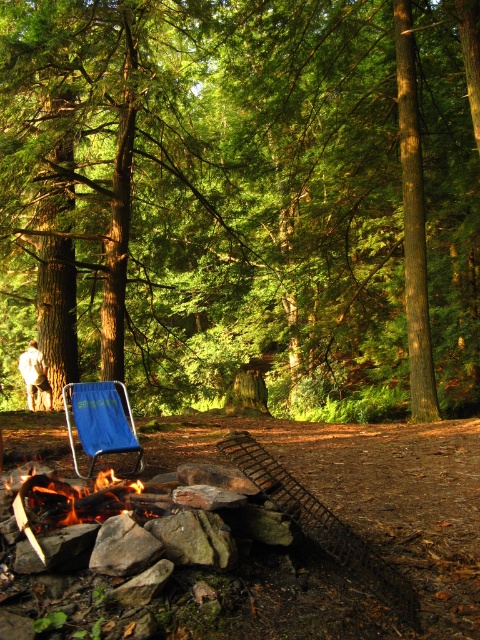
You are standing in the forest scene and want to move closer to the flaming wood fire at lower left. If your maximum comfortable walking distance is 3 meters, can you reach the fire without straining?

The flaming wood fire at lower left is 3.25 meters away from viewer. Since the distance is slightly beyond your 3 meter limit, you would need to take a few extra steps to reach it, which may require a bit of effort but is still manageable.